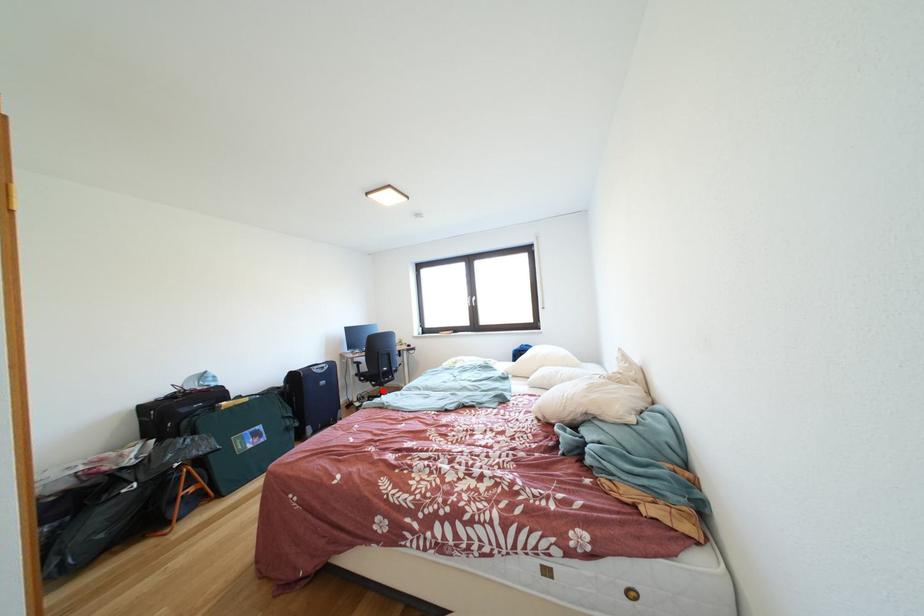
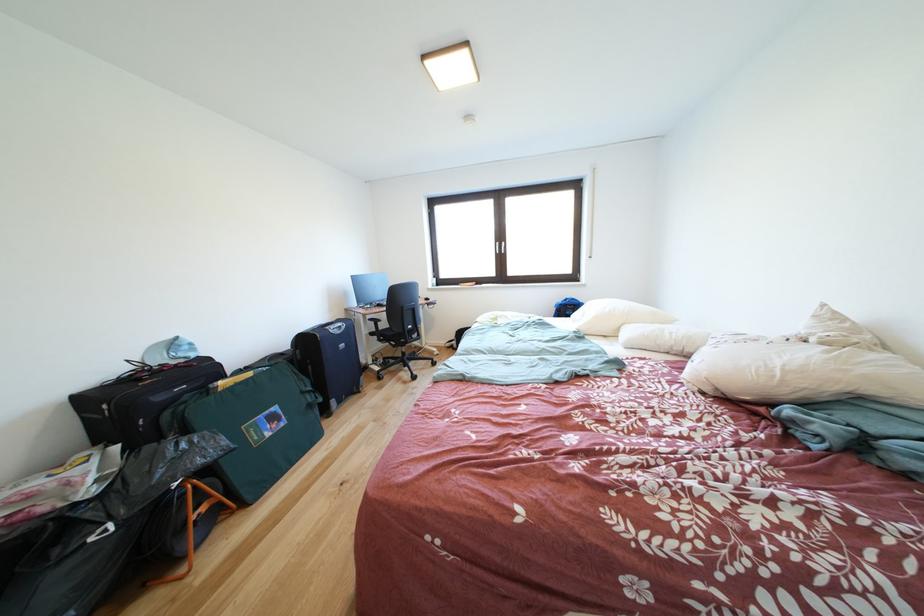
Find the pixel in the second image that matches the highlighted location in the first image.

(403, 351)